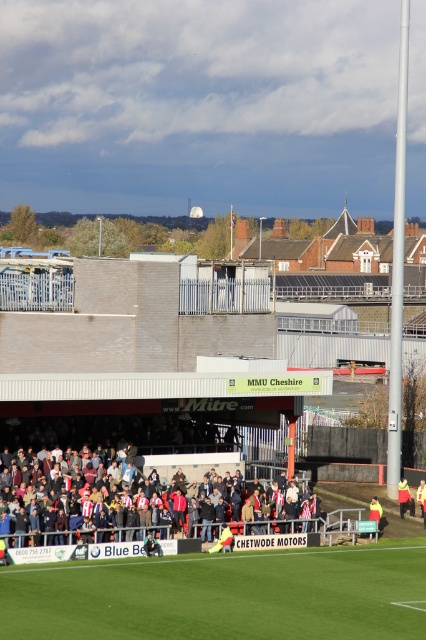
What is the spatial relationship between the red fabric crowd at center and the yellow fabric jacket at lower right in the stadium scene?

The red fabric crowd at center is positioned over the yellow fabric jacket at lower right, meaning the crowd is located above the jacket in the image.

What is the spatial relationship between the green grass at lower center and the red fabric crowd at center in the stadium scene?

The green grass at lower center is positioned in front of the red fabric crowd at center, meaning the grass is closer to the viewer while the crowd is situated behind it in the scene.